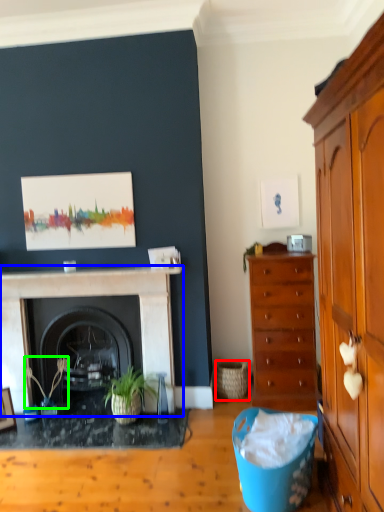
Question: Which object is the closest to the basket (highlighted by a red box)? Choose among these: fireplace (highlighted by a blue box) or plant (highlighted by a green box).

Choices:
 (A) fireplace
 (B) plant

Answer: (A)